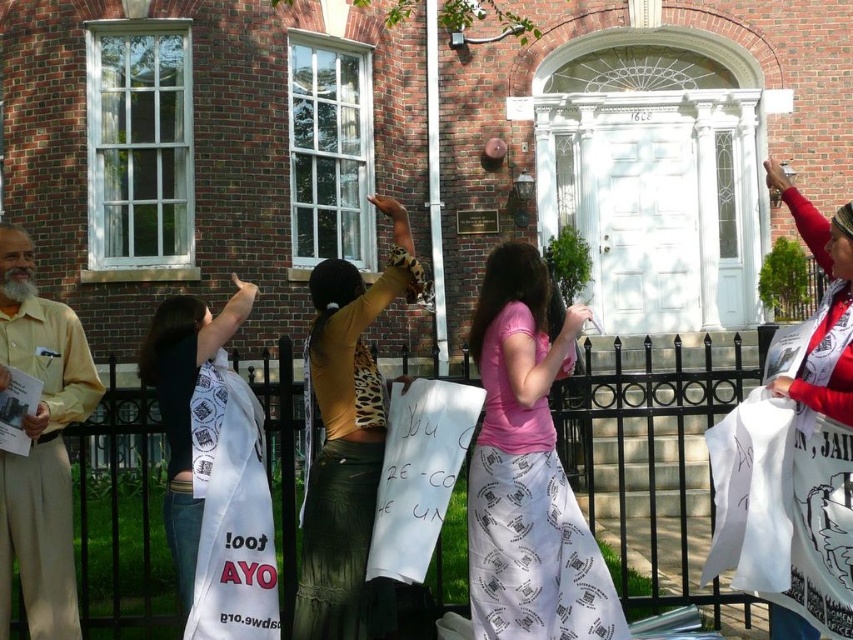
Which is more to the right, pink fabric skirt at center or white paper sign at upper right?

Positioned to the right is white paper sign at upper right.

Which is above, pink fabric skirt at center or white paper sign at upper right?

white paper sign at upper right

Who is more forward, (532,396) or (827,305)?

Point (532,396)

Where is `pink fabric skirt at center`? pink fabric skirt at center is located at coordinates (527, 472).

Does black metal fence at center have a larger size compared to leopard print blouse at center?

Yes, black metal fence at center is bigger than leopard print blouse at center.

Does black metal fence at center have a greater height compared to leopard print blouse at center?

Yes.

The image size is (853, 640). Find the location of `black metal fence at center`. black metal fence at center is located at coordinates (651, 449).

Looking at this image, is black metal fence at center thinner than beige cotton pants at left?

No.

You are a GUI agent. You are given a task and a screenshot of the screen. Output one action in this format:
    pyautogui.click(x=<x>, y=<y>)
    Task: Click on the black metal fence at center
    Image resolution: width=853 pixels, height=640 pixels.
    Given the screenshot: What is the action you would take?
    pyautogui.click(x=651, y=449)

Where is `black metal fence at center`? black metal fence at center is located at coordinates (651, 449).